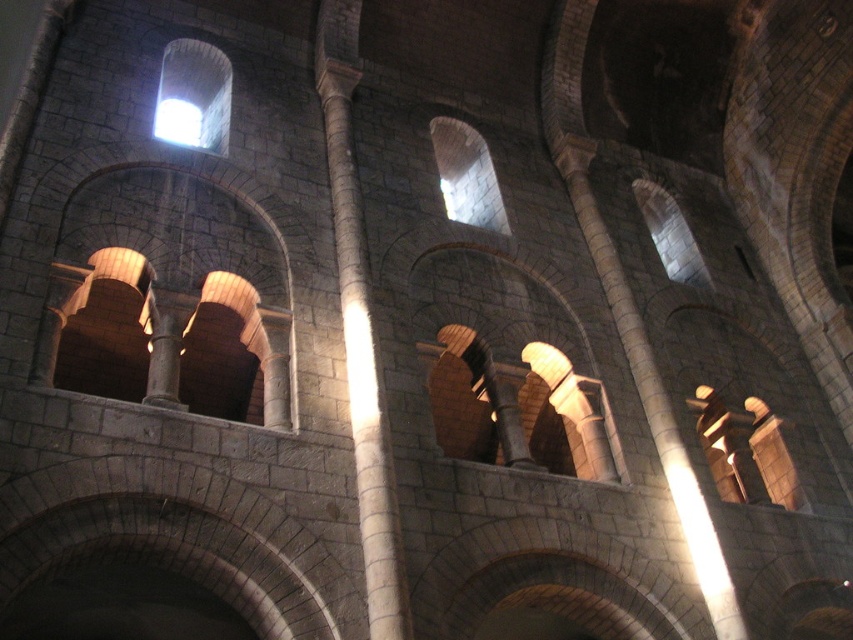
Describe the element at coordinates (360, 326) in the screenshot. I see `smooth stone column at center` at that location.

Is smooth stone column at center further to the viewer compared to white glossy light at upper center?

No.

I want to click on smooth stone column at center, so click(x=360, y=326).

Locate an element on the screen. This screenshot has height=640, width=853. smooth stone column at center is located at coordinates (360, 326).